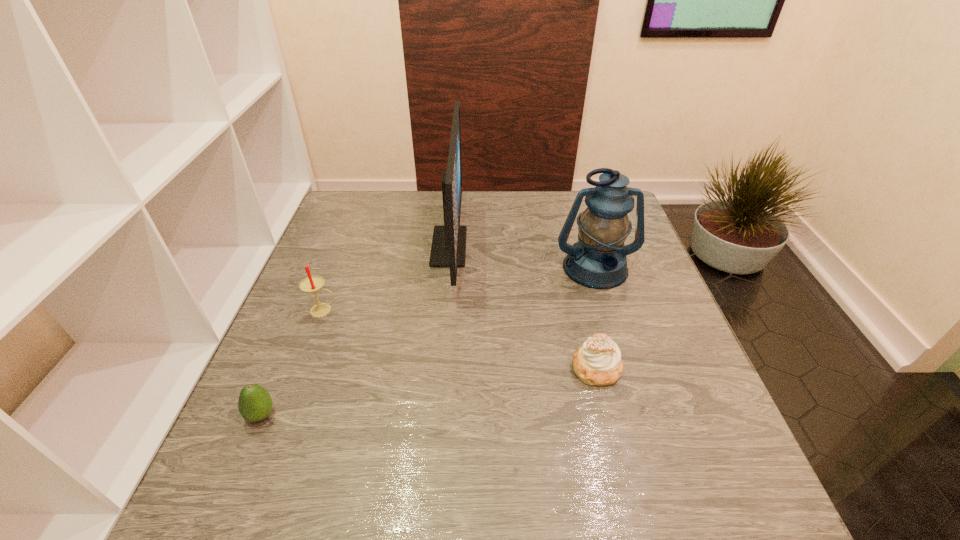
Find the location of a particular element. the third object from right to left is located at coordinates (448, 249).

This screenshot has height=540, width=960. Find the location of `the second tallest object`. the second tallest object is located at coordinates (598, 260).

At what (x,y) coordinates should I click in order to perform the action: click on the third tallest object. Please return your answer as a coordinate pair (x, y). This screenshot has width=960, height=540. Looking at the image, I should click on (310, 284).

The image size is (960, 540). I want to click on the second nearest object, so click(597, 362).

In order to click on avocado in this screenshot , I will do `click(255, 404)`.

Identify the location of vacant space located on the screen side of the computer monitor. (548, 247).

You are a GUI agent. You are given a task and a screenshot of the screen. Output one action in this format:
    pyautogui.click(x=<x>, y=<y>)
    Task: Click on the vacant space located 0.080m on the face of the lantern
    Image resolution: width=960 pixels, height=540 pixels.
    Given the screenshot: What is the action you would take?
    pyautogui.click(x=609, y=313)

This screenshot has height=540, width=960. Find the location of `free location located 0.080m on the front of the candle`. free location located 0.080m on the front of the candle is located at coordinates (310, 345).

Locate an element on the screen. Image resolution: width=960 pixels, height=540 pixels. free spot located 0.170m on the back of the pastry is located at coordinates (579, 296).

Locate an element on the screen. This screenshot has height=540, width=960. vacant area located on the back of the nearest object is located at coordinates (299, 326).